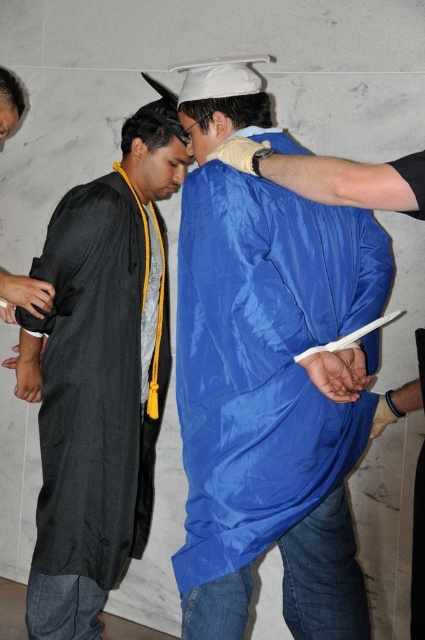
Question: Where is blue fabric graduation gown at center located in relation to matte black graduation gown at left in the image?

Choices:
 (A) above
 (B) below

Answer: (A)

Question: Which point is farther from the camera taking this photo?

Choices:
 (A) (238, 460)
 (B) (136, 474)

Answer: (B)

Question: Which point is closer to the camera taking this photo?

Choices:
 (A) (130, 346)
 (B) (365, 308)

Answer: (B)

Question: Can you confirm if blue fabric graduation gown at center is positioned below matte black graduation gown at left?

Choices:
 (A) no
 (B) yes

Answer: (A)

Question: Which object is farther from the camera taking this photo?

Choices:
 (A) matte black graduation gown at left
 (B) blue fabric graduation gown at center

Answer: (A)

Question: Can you confirm if blue fabric graduation gown at center is positioned to the left of matte black graduation gown at left?

Choices:
 (A) no
 (B) yes

Answer: (A)